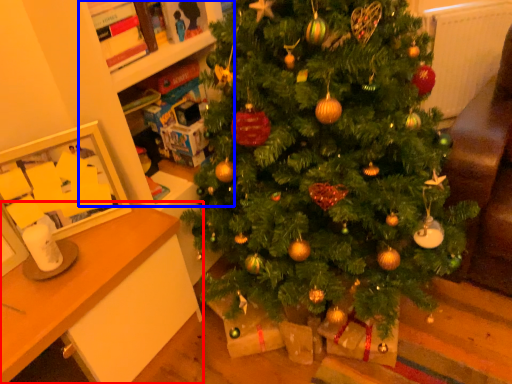
Question: Which object appears closest to the camera in this image, desk (highlighted by a red box) or bookshelf (highlighted by a blue box)?

Choices:
 (A) desk
 (B) bookshelf

Answer: (A)